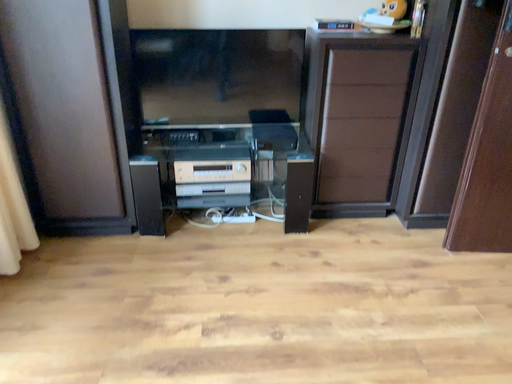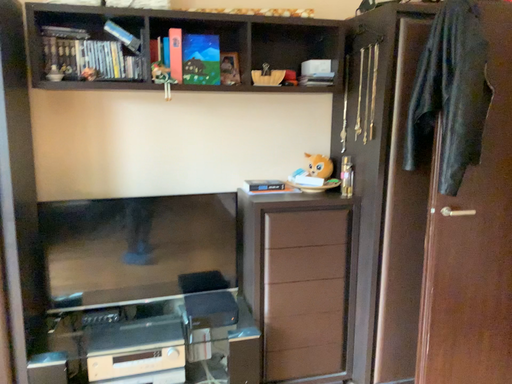
Question: How did the camera likely rotate when shooting the video?

Choices:
 (A) rotated left
 (B) rotated right

Answer: (B)